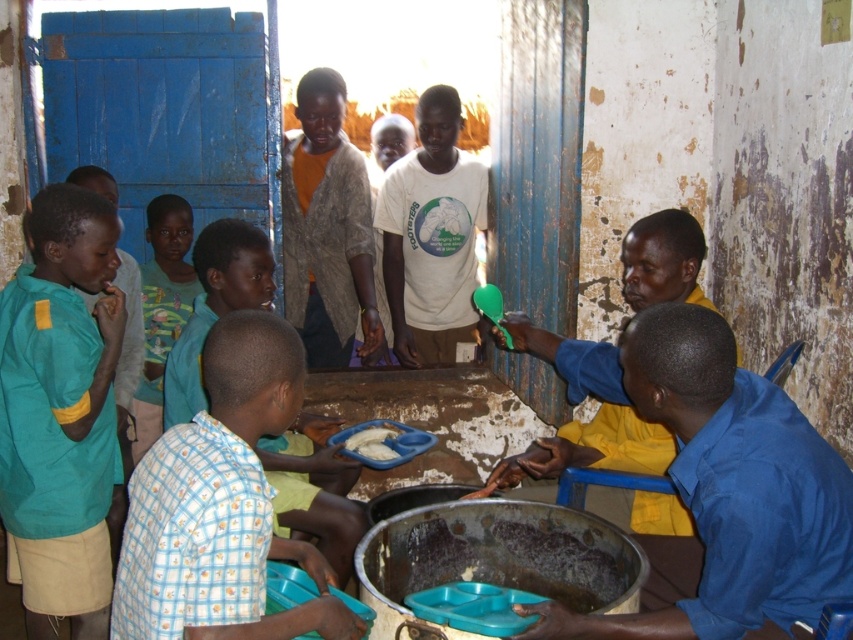
Question: Among these objects, which one is nearest to the camera?

Choices:
 (A) green fabric shirt at left
 (B) green cotton shirt at center
 (C) light blue checkered shirt at center
 (D) blue shirt at right

Answer: (D)

Question: Is blue shirt at right wider than light blue checkered shirt at center?

Choices:
 (A) no
 (B) yes

Answer: (B)

Question: Can you confirm if blue shirt at right is positioned to the left of green cotton shirt at center?

Choices:
 (A) no
 (B) yes

Answer: (A)

Question: Which is nearer to the white matte food at center?

Choices:
 (A) blue fabric shirt at right
 (B) light blue checkered shirt at center
 (C) blue shirt at right

Answer: (B)

Question: Can you confirm if green fabric shirt at left is thinner than green cotton shirt at center?

Choices:
 (A) no
 (B) yes

Answer: (A)

Question: Which object is positioned closest to the green fabric shirt at left?

Choices:
 (A) light blue checkered shirt at center
 (B) blue shirt at right
 (C) green cotton shirt at center
 (D) white matte t-shirt at center

Answer: (A)